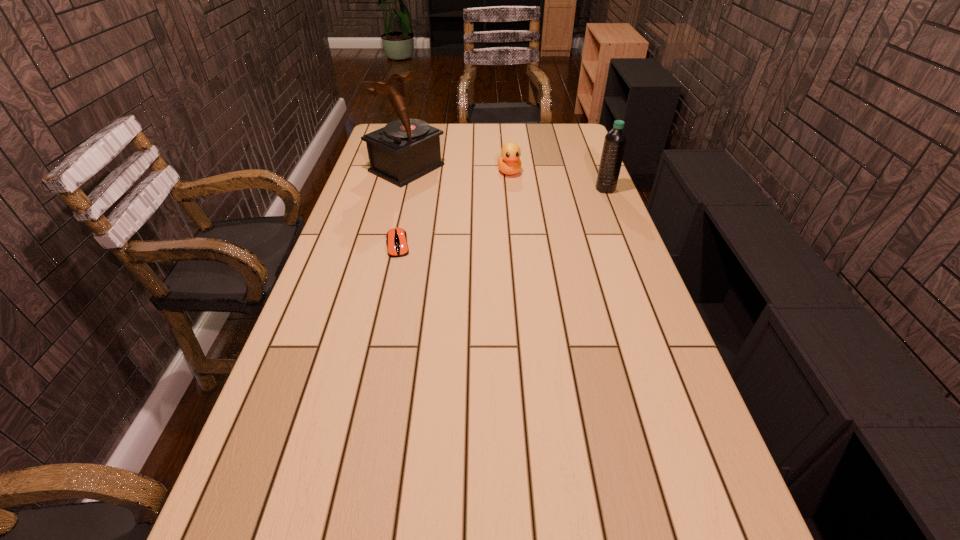
The height and width of the screenshot is (540, 960). I want to click on empty location between the tallest object and the duckling, so click(x=458, y=170).

You are a GUI agent. You are given a task and a screenshot of the screen. Output one action in this format:
    pyautogui.click(x=<x>, y=<y>)
    Task: Click on the empty location between the second object from right to left and the rightmost object
    
    Given the screenshot: What is the action you would take?
    point(557,180)

Locate an element on the screen. object that stands as the third closest to the second object from right to left is located at coordinates (397, 246).

I want to click on object that is the third closest to the phonograph_record, so click(615, 140).

Locate an element on the screen. The image size is (960, 540). free point that satisfies the following two spatial constraints: 1. on the back side of the duckling; 2. on the left side of the computer mouse is located at coordinates (415, 172).

Identify the location of free point that satisfies the following two spatial constraints: 1. on the back side of the nearest object; 2. on the right side of the second tallest object. This screenshot has height=540, width=960. (411, 189).

Where is `free spot that satisfies the following two spatial constraints: 1. on the back side of the second object from right to left; 2. on the right side of the computer mouse`? This screenshot has width=960, height=540. free spot that satisfies the following two spatial constraints: 1. on the back side of the second object from right to left; 2. on the right side of the computer mouse is located at coordinates (415, 172).